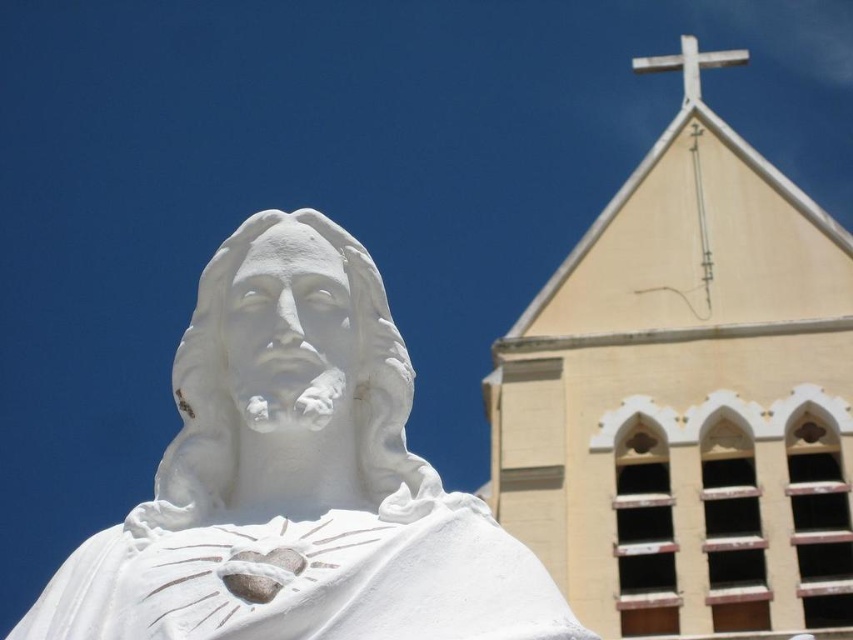
You are standing in front of the white statue of Jesus Christ and want to take a photo that includes both the beige stone church at upper right and the white wooden cross at upper center. Which of these two objects should you adjust your camera angle to include first, considering their sizes?

The beige stone church at upper right is bigger than the white wooden cross at upper center, so you should adjust your camera angle to include the beige stone church at upper right first since it takes up more space in the frame.

What are the coordinates of the white marble statue at center?

The white marble statue at center is located at point (x=297, y=480).